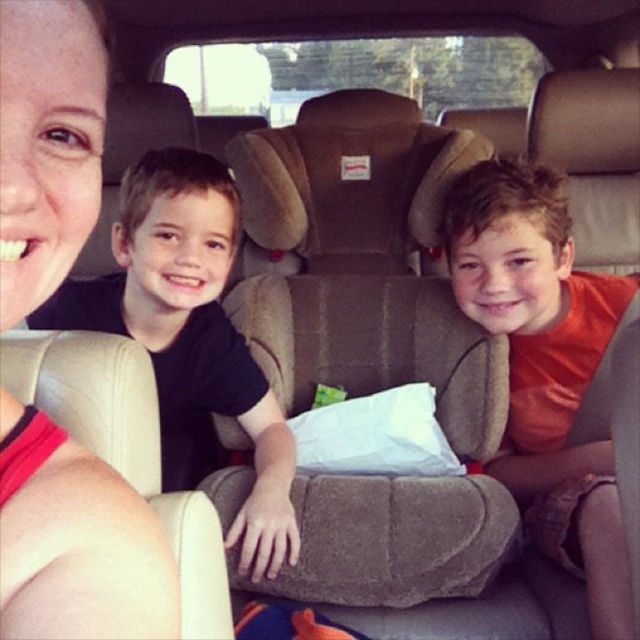
You are inside the car and looking at the backseat. There are two points marked on the backseat seats. The first point is at coordinates point (51,36) and the second point is at point (172,253). Which of these two points is closer to you?

Point (51,36) is closer to the camera than point (172,253), so the first point is closer to you.

You are a fashion designer observing the car interior scene. You notice the matte pink tank top at upper left and the black matte shirt at center. Which clothing item has a smaller size?

The matte pink tank top at upper left is smaller than the black matte shirt at center.

You are a fashion designer observing the car interior scene. You notice the matte pink tank top at upper left and the orange cotton shirt at center. Which clothing item is shorter in length?

The matte pink tank top at upper left has a lesser height compared to the orange cotton shirt at center, so the matte pink tank top at upper left is shorter in length.